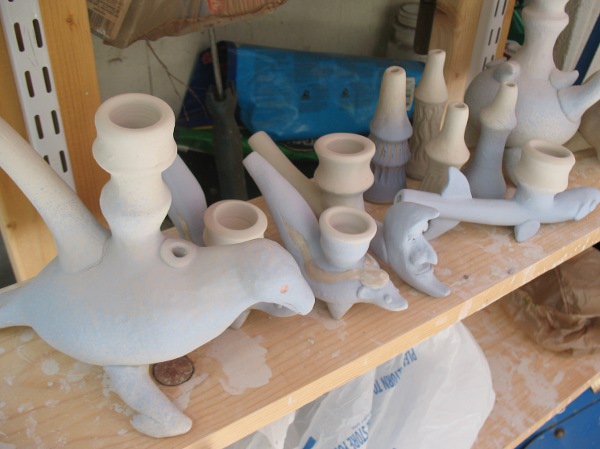
At what (x,y) coordinates should I click in order to perform the action: click on candle holder with blue coloring. Please return your answer as a coordinate pair (x, y). This screenshot has height=449, width=600. Looking at the image, I should click on (383, 152), (490, 175), (506, 218), (394, 237), (293, 213), (188, 199).